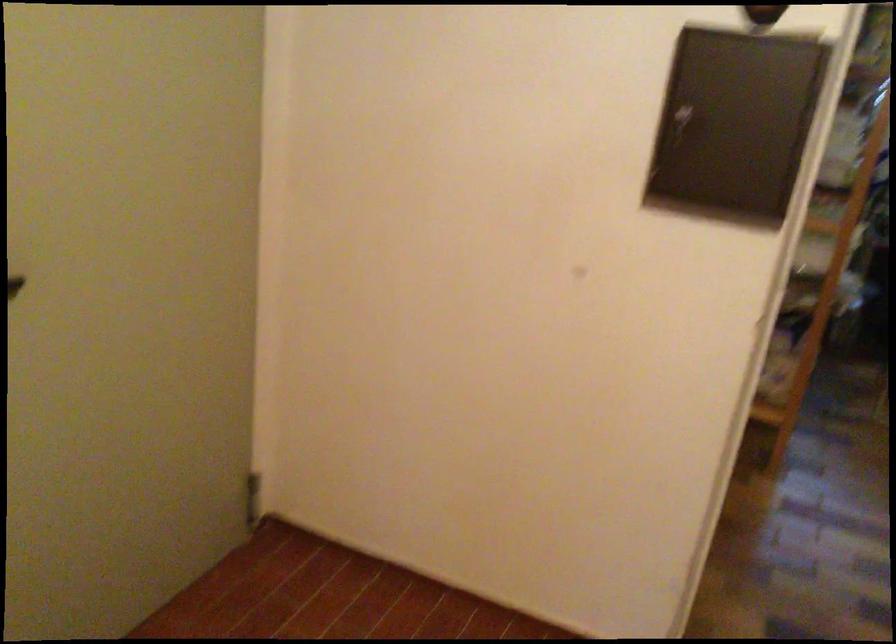
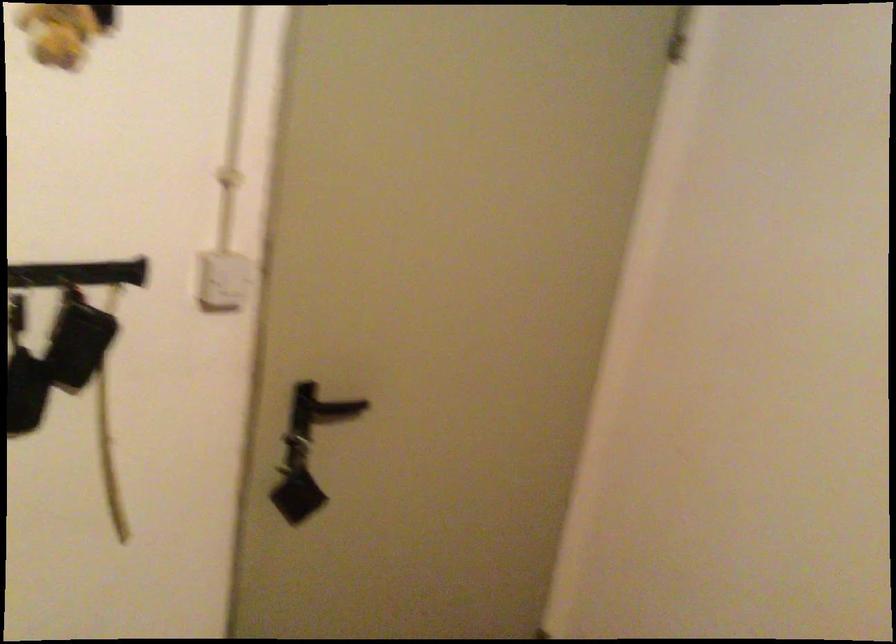
The images are taken continuously from a first-person perspective. In which direction are you moving?

The cameraman moved toward left, forward.